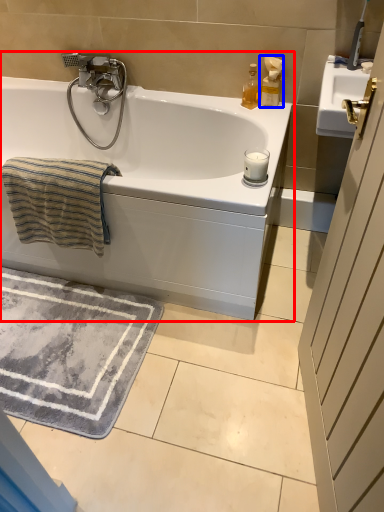
Question: Among these objects, which one is nearest to the camera, bathtub (highlighted by a red box) or soap dispenser (highlighted by a blue box)?

Choices:
 (A) bathtub
 (B) soap dispenser

Answer: (A)